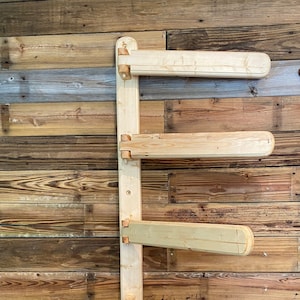
This screenshot has width=300, height=300. Identify the location of rounded edge of vertical wood. (129, 39).